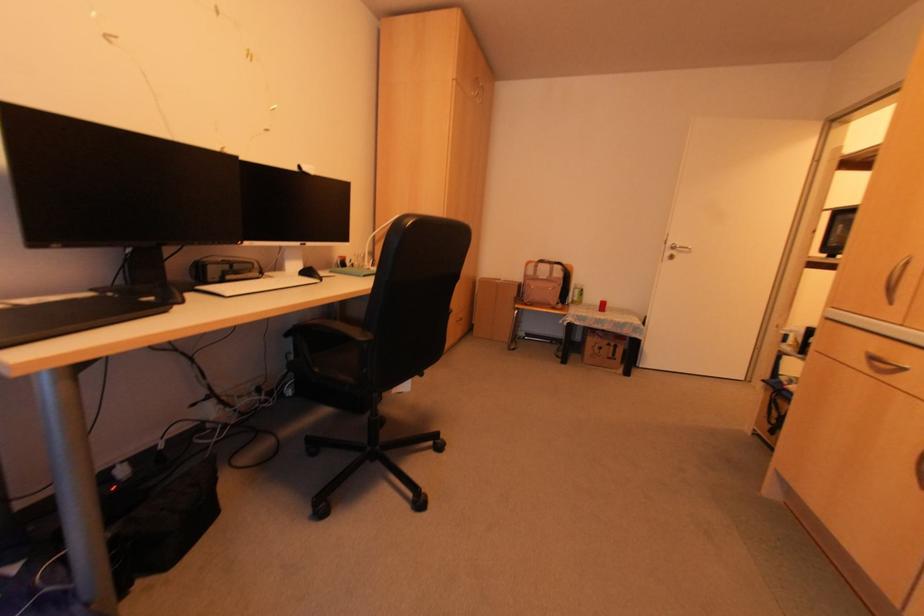
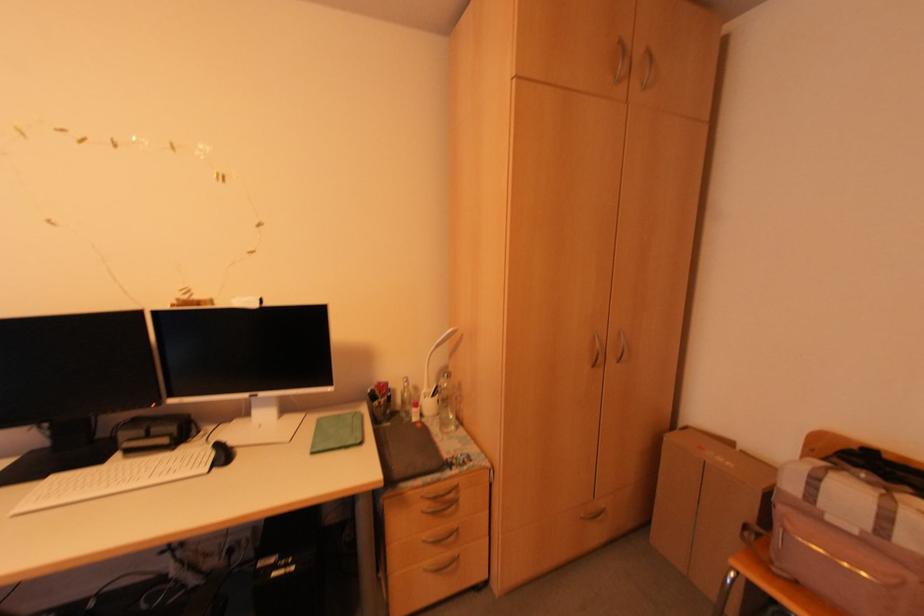
The point at (496,280) is marked in the first image. Where is the corresponding point in the second image?

(728, 444)